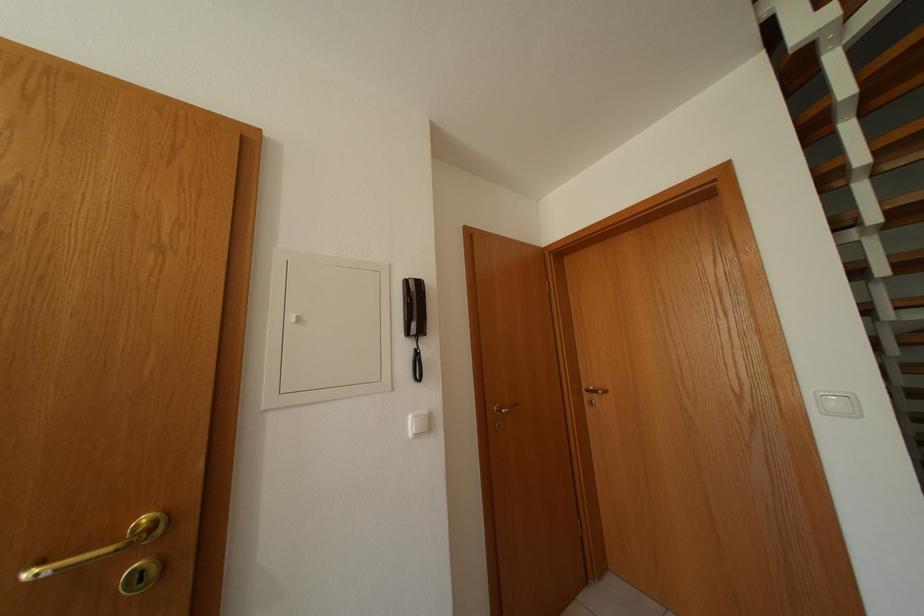
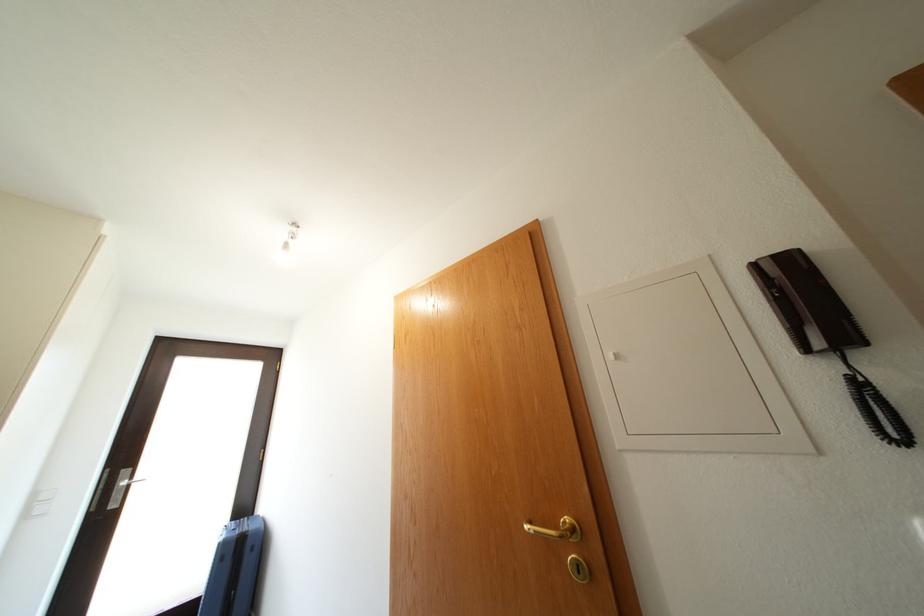
In the second image, find the point that corresponds to point 415,286 in the first image.

(763, 272)